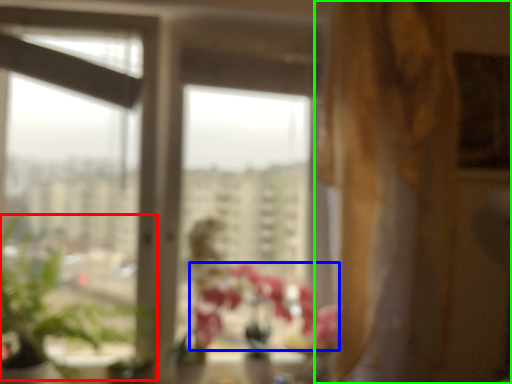
Question: Estimate the real-world distances between objects in this image. Which object is farther from plant (highlighted by a red box), flower (highlighted by a blue box) or curtain (highlighted by a green box)?

Choices:
 (A) flower
 (B) curtain

Answer: (B)